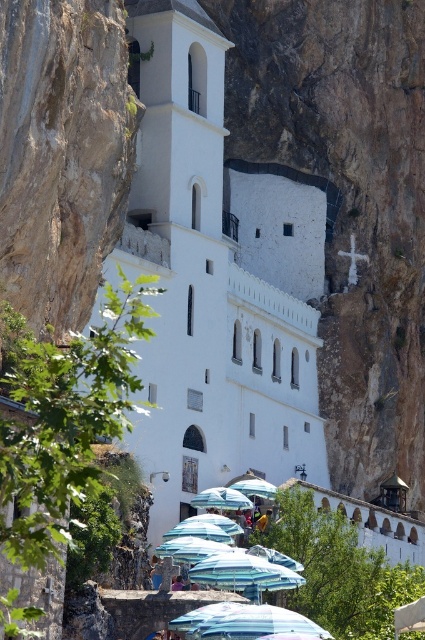
Question: In this image, where is white smooth stone church at center located relative to blue fabric umbrella at lower center?

Choices:
 (A) left
 (B) right

Answer: (A)

Question: Considering the relative positions of white smooth stone church at center and blue fabric umbrella at lower center in the image provided, where is white smooth stone church at center located with respect to blue fabric umbrella at lower center?

Choices:
 (A) right
 (B) left

Answer: (B)

Question: Which of the following is the closest to the observer?

Choices:
 (A) blue fabric umbrella at lower center
 (B) white smooth stone church at center

Answer: (A)

Question: Which point is closer to the camera taking this photo?

Choices:
 (A) (187, 376)
 (B) (305, 632)

Answer: (B)

Question: Considering the relative positions of white smooth stone church at center and blue fabric umbrella at lower center in the image provided, where is white smooth stone church at center located with respect to blue fabric umbrella at lower center?

Choices:
 (A) right
 (B) left

Answer: (B)